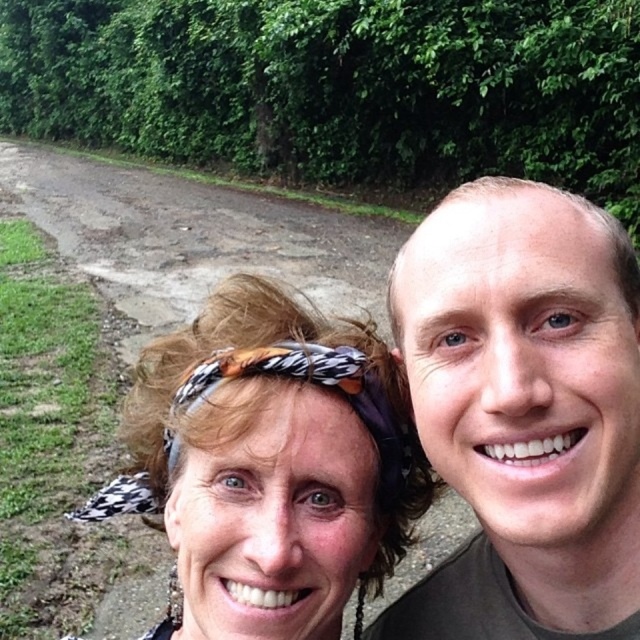
You are a photographer trying to capture the matte black headband at center and the printed fabric headscarf at center in a clear photo. Which one is positioned lower in the frame?

The matte black headband at center is below the printed fabric headscarf at center, so it is positioned lower in the frame.

You are a photographer holding a camera with a 50mm lens. The recommended focusing distance for this lens is between 18 to 22 inches. Can you focus on the smooth skin face at right without adjusting your position?

The distance between the smooth skin face at right and the viewer is 19.15 inches, which falls within the recommended focusing range of 18 to 22 inches. Therefore, you can focus on the smooth skin face at right without needing to adjust your position.